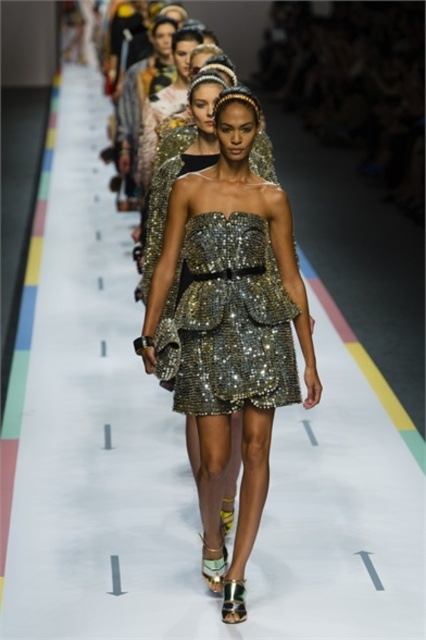
You are a photographer at the runway show and need to capture both the sparkly metallic dress at center and the shiny sequined dress at center in one shot. Which dress should you focus on to ensure both are visible in the frame?

The sparkly metallic dress at center is larger in size than the shiny sequined dress at center, so focusing on the sparkly metallic dress at center will ensure both are visible in the frame.

You are a model walking on the runway. You need to reach the end of the runway before the music ends. There are two points marked on the runway at coordinates point (262, 186) and point (224, 353). Which point should you step on first to ensure you reach the end on time?

You should step on point (224, 353) first because point (262, 186) is behind it, meaning point (224, 353) is closer to the starting point and you will reach it first while moving towards the end of the runway.

You are a photographer at the runway show. You need to capture a photo where the sparkly metallic dress at center and the shiny sequined dress at center are both visible. Which dress should you focus on to ensure both are in the frame?

You should focus on the sparkly metallic dress at center because it is in front of the shiny sequined dress at center, so keeping the sparkly metallic dress at center in focus will naturally include the shiny sequined dress at center in the background.